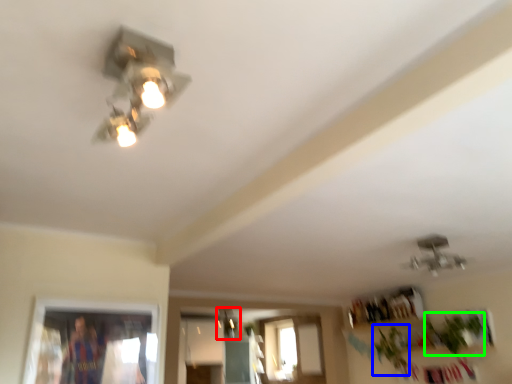
Question: Based on their relative distances, which object is farther from lamp (highlighted by a red box)? Choose from plant (highlighted by a blue box) and plant (highlighted by a green box).

Choices:
 (A) plant
 (B) plant

Answer: (B)